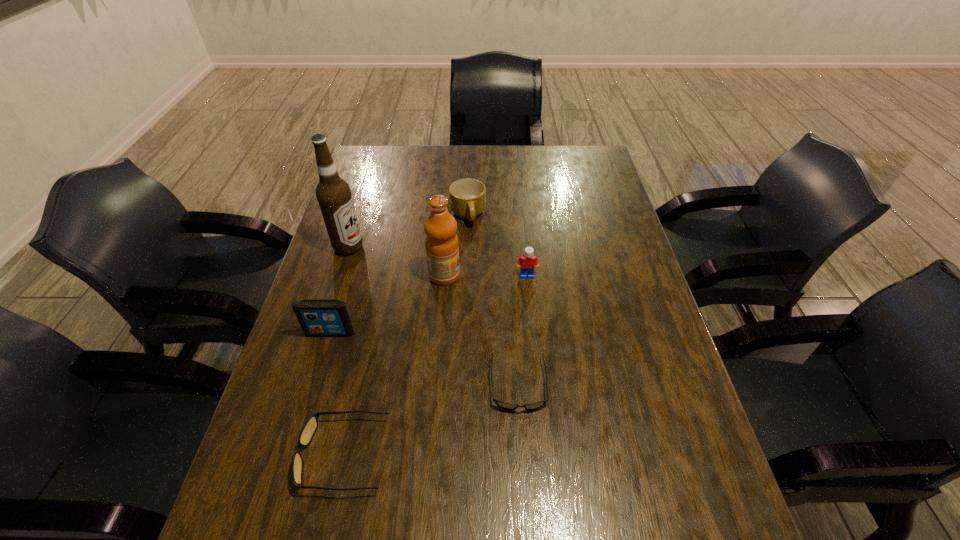
Image resolution: width=960 pixels, height=540 pixels. Find the location of `free point between the Lego and the nearer sunglasses`. free point between the Lego and the nearer sunglasses is located at coordinates (435, 365).

You are a GUI agent. You are given a task and a screenshot of the screen. Output one action in this format:
    pyautogui.click(x=<x>, y=<y>)
    Task: Click on the free space between the fruit juice and the iPod
    Image resolution: width=960 pixels, height=540 pixels.
    Given the screenshot: What is the action you would take?
    pyautogui.click(x=387, y=304)

This screenshot has height=540, width=960. I want to click on vacant space that's between the mug and the iPod, so click(399, 274).

Where is `free space between the Lego and the iPod`? free space between the Lego and the iPod is located at coordinates (428, 304).

Where is `unoccupied area between the second farthest object and the third shortest object`? This screenshot has height=540, width=960. unoccupied area between the second farthest object and the third shortest object is located at coordinates (408, 231).

The image size is (960, 540). I want to click on free point between the shortest object and the third nearest object, so click(x=424, y=359).

The image size is (960, 540). I want to click on unoccupied position between the sixth tallest object and the iPod, so click(x=337, y=394).

Identify the location of vacant space that's between the fruit juice and the iPod. (387, 304).

Locate which object ranks in proximity to the iPod. Please provide its 2D coordinates. Your answer should be formatted as a tuple, i.e. [(x, y)], where the tuple contains the x and y coordinates of a point satisfying the conditions above.

[(309, 428)]

Locate an element on the screen. This screenshot has width=960, height=540. the closest object to the fifth tallest object is located at coordinates (441, 242).